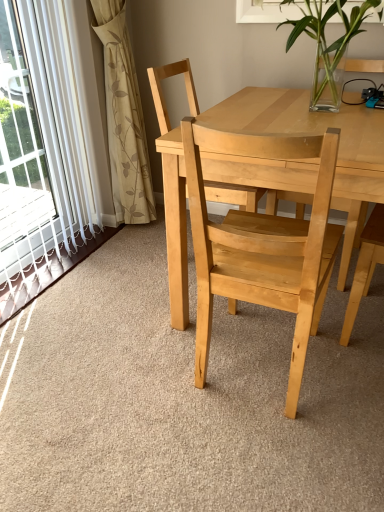
Locate an element on the screen. Image resolution: width=384 pixels, height=512 pixels. free space in front of beige floral fabric curtain at left is located at coordinates (124, 258).